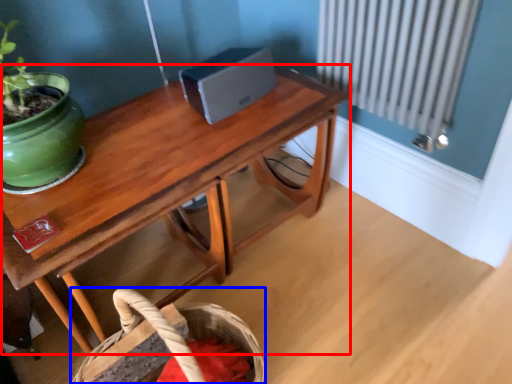
Question: Which object is closer to the camera taking this photo, table (highlighted by a red box) or basket (highlighted by a blue box)?

Choices:
 (A) table
 (B) basket

Answer: (A)